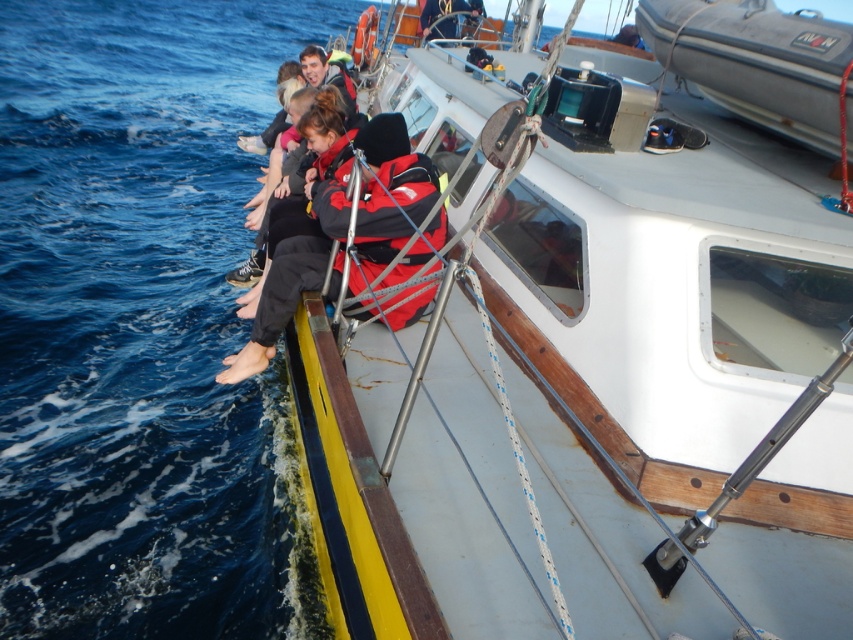
You are standing on the dock and see the white plastic boat at center and the red jacket at left. Which object is closer to your left side?

The red jacket at left is closer to your left side since it is positioned to the left of the white plastic boat at center.

You are a passenger on the boat and want to take a photo of the gray rubber dinghy at upper right without the blue water at lower left blocking the view. Is this possible?

The gray rubber dinghy at upper right is behind blue water at lower left, so taking a photo without the blue water at lower left blocking the view is not possible.